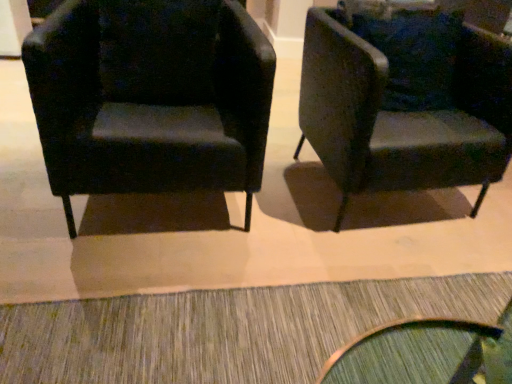
Identify the location of free space in front of matte black armchair at left, acting as the first chair starting from the left. The height and width of the screenshot is (384, 512). (129, 263).